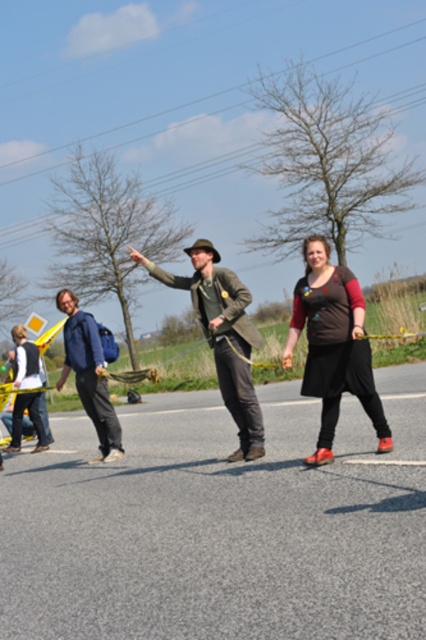
You are taking a photo of the scene and want to focus on both the man pointing off to the side and the woman smiling towards the camera. Which of the two points, point (319, 380) or point (226, 364), should you adjust your camera focus to ensure both are in clear view?

Point (319, 380) is closer to the camera than point (226, 364). To ensure both are in clear view, focus on the closer point, which is point (319, 380), as focusing on it will also keep the farther point within the depth of field.

Consider the image. You are a photographer standing 3 meters away from the green canvas jacket at center and blue denim jacket at center. You want to take a photo that includes both jackets in the frame. Given that your camera has a maximum horizontal field of view of 1.8 meters, will you be able to capture both jackets in a single shot?

The green canvas jacket at center and blue denim jacket at center are 2.08 meters apart from each other. Since the distance between them exceeds the camera s maximum horizontal field of view of 1.8 meters, you will not be able to capture both jackets in a single shot.